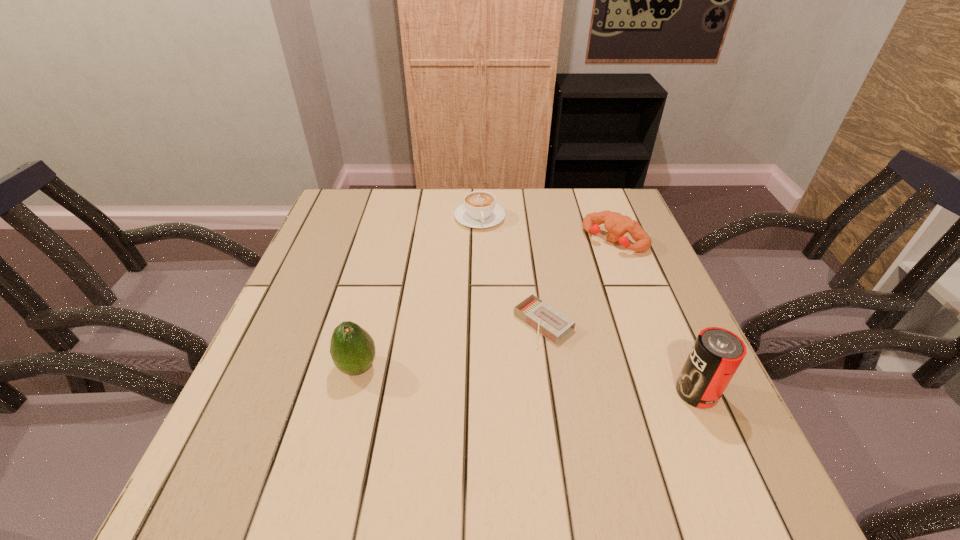
Locate an element on the screen. This screenshot has height=540, width=960. cappuccino present at the far edge is located at coordinates click(x=479, y=210).

Image resolution: width=960 pixels, height=540 pixels. In order to click on object that is at the near edge in this screenshot , I will do `click(717, 353)`.

Where is `can situated at the right edge`? This screenshot has height=540, width=960. can situated at the right edge is located at coordinates (717, 353).

Image resolution: width=960 pixels, height=540 pixels. Identify the location of puncher that is at the right edge. (617, 225).

Locate an element on the screen. The width and height of the screenshot is (960, 540). object that is at the far right corner is located at coordinates click(617, 225).

I want to click on object at the near right corner, so click(717, 353).

Locate an element on the screen. This screenshot has width=960, height=540. vacant space at the far edge is located at coordinates (513, 203).

At what (x,y) coordinates should I click in order to perform the action: click on vacant space at the near edge of the desktop. Please return your answer as a coordinate pair (x, y). The width and height of the screenshot is (960, 540). Looking at the image, I should click on (533, 446).

This screenshot has height=540, width=960. In order to click on blank area at the right edge in this screenshot , I will do `click(660, 353)`.

Locate an element on the screen. This screenshot has width=960, height=540. vacant region at the near left corner of the desktop is located at coordinates (228, 449).